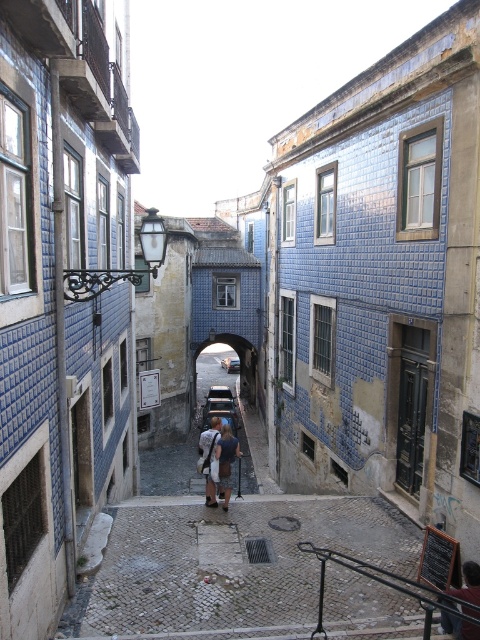
Question: Among these points, which one is nearest to the camera?

Choices:
 (A) (220, 484)
 (B) (229, 362)
 (C) (456, 621)

Answer: (C)

Question: Can you confirm if denim jacket at center is bigger than metallic silver car at center?

Choices:
 (A) no
 (B) yes

Answer: (B)

Question: Which of these objects is positioned farthest from the denim jacket at center?

Choices:
 (A) metallic silver car at center
 (B) dark blue jeans at center

Answer: (A)

Question: Does denim jacket at center have a greater width compared to dark blue jeans at center?

Choices:
 (A) yes
 (B) no

Answer: (A)

Question: Which of the following is the farthest from the observer?

Choices:
 (A) dark blue jeans at center
 (B) metallic silver car at center

Answer: (B)

Question: Considering the relative positions of denim jacket at center and dark blue jeans at center in the image provided, where is denim jacket at center located with respect to dark blue jeans at center?

Choices:
 (A) right
 (B) left

Answer: (B)